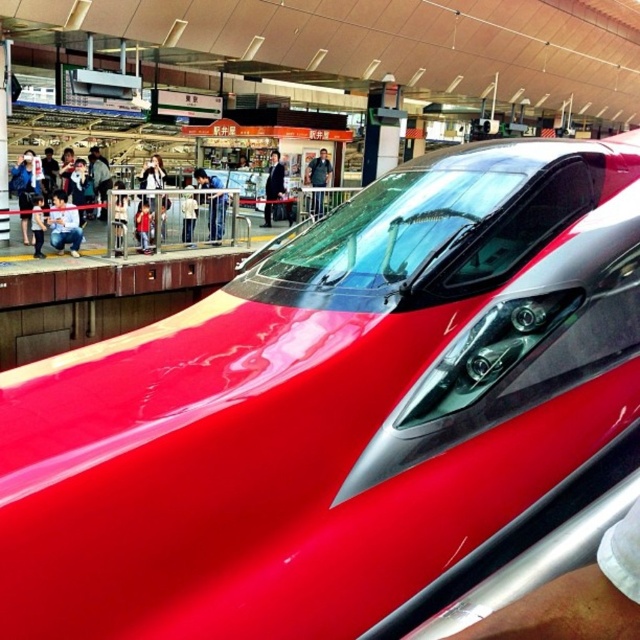
Question: Among these points, which one is nearest to the camera?

Choices:
 (A) (150, 186)
 (B) (70, 228)
 (C) (324, 156)
 (D) (276, 152)

Answer: (B)

Question: Estimate the real-world distances between objects in this image. Which object is closer to the white fabric jacket at center?

Choices:
 (A) matte black jacket at center
 (B) jeans at left
 (C) black suit at center

Answer: (A)

Question: Is jeans at left in front of smooth skin person at center?

Choices:
 (A) yes
 (B) no

Answer: (A)

Question: Estimate the real-world distances between objects in this image. Which object is farther from the jeans at left?

Choices:
 (A) black suit at center
 (B) smooth skin person at center

Answer: (A)

Question: Is matte black jacket at center in front of dark blue shirt at center?

Choices:
 (A) yes
 (B) no

Answer: (A)

Question: Does dark blue shirt at center have a lesser width compared to white fabric jacket at center?

Choices:
 (A) yes
 (B) no

Answer: (B)